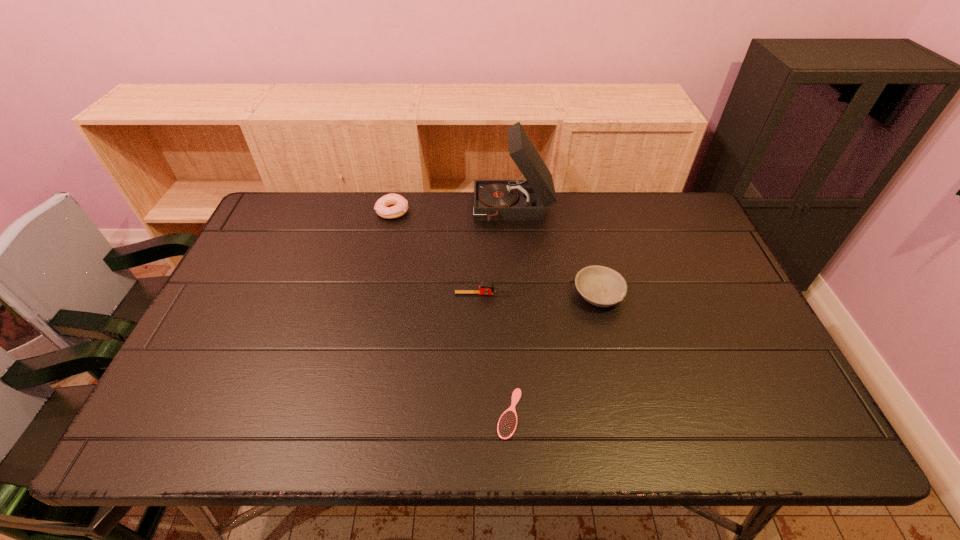
Choose which object is the fourth nearest neighbor to the shortest object. Please provide its 2D coordinates. Your answer should be formatted as a tuple, i.e. [(x, y)], where the tuple contains the x and y coordinates of a point satisfying the conditions above.

[(400, 207)]

Where is `the closest object to the rightmost object`? the closest object to the rightmost object is located at coordinates (485, 288).

This screenshot has width=960, height=540. Find the location of `vacant position in the image that satisfies the following two spatial constraints: 1. on the front-facing side of the phonograph_record; 2. on the left side of the bowl`. vacant position in the image that satisfies the following two spatial constraints: 1. on the front-facing side of the phonograph_record; 2. on the left side of the bowl is located at coordinates (520, 294).